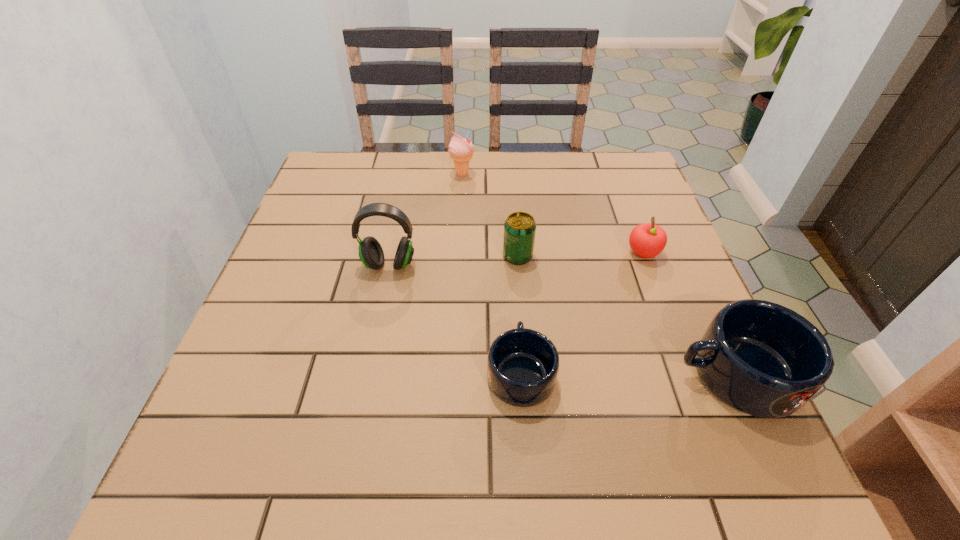
The mugs are evenly distributed in the image. To maintain this, where would you place another mug on the left? Please point to a free space. Please provide its 2D coordinates. Your answer should be formatted as a tuple, i.e. [(x, y)], where the tuple contains the x and y coordinates of a point satisfying the conditions above.

[(307, 370)]